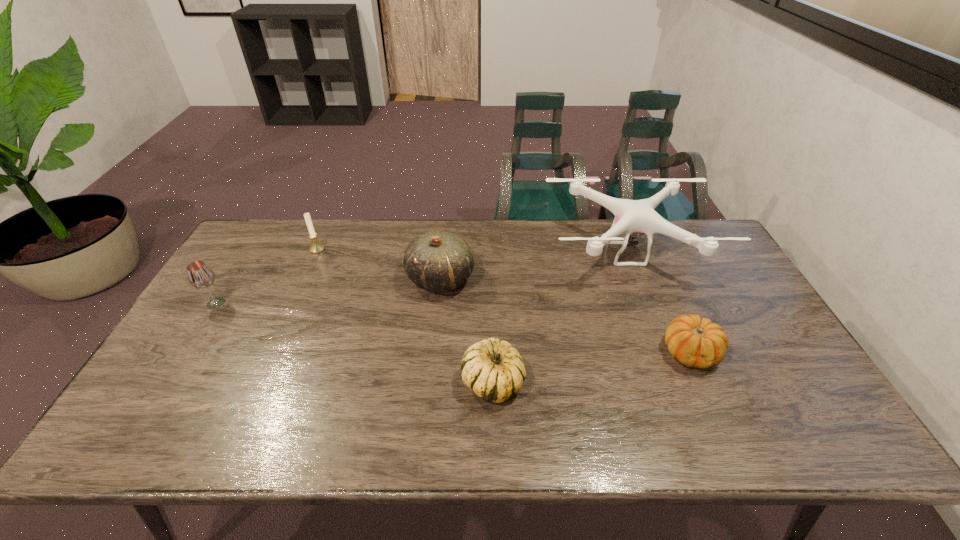
At what (x,y) coordinates should I click in order to perform the action: click on vacant space situated on the back of the wineglass. Please return your answer as a coordinate pair (x, y). Image resolution: width=960 pixels, height=540 pixels. Looking at the image, I should click on (243, 259).

At what (x,y) coordinates should I click in order to perform the action: click on free point located 0.320m on the left of the second tallest gourd. Please return your answer as a coordinate pair (x, y). The width and height of the screenshot is (960, 540). Looking at the image, I should click on (332, 382).

You are a GUI agent. You are given a task and a screenshot of the screen. Output one action in this format:
    pyautogui.click(x=<x>, y=<y>)
    Task: Click on the vacant area situated on the front of the shortest object
    The image size is (960, 540).
    Given the screenshot: What is the action you would take?
    pyautogui.click(x=710, y=396)

Locate an element on the screen. drone that is positioned at the far edge is located at coordinates (631, 216).

Find the location of a particular element. gourd that is at the far edge is located at coordinates (439, 261).

This screenshot has width=960, height=540. I want to click on candle holder located in the far edge section of the desktop, so click(x=316, y=248).

Where is `object at the left edge`? The height and width of the screenshot is (540, 960). object at the left edge is located at coordinates (200, 275).

The height and width of the screenshot is (540, 960). I want to click on object that is at the right edge, so click(631, 216).

This screenshot has width=960, height=540. I want to click on object present at the far right corner, so click(631, 216).

Find the location of `vacant space at the far edge`. vacant space at the far edge is located at coordinates (499, 228).